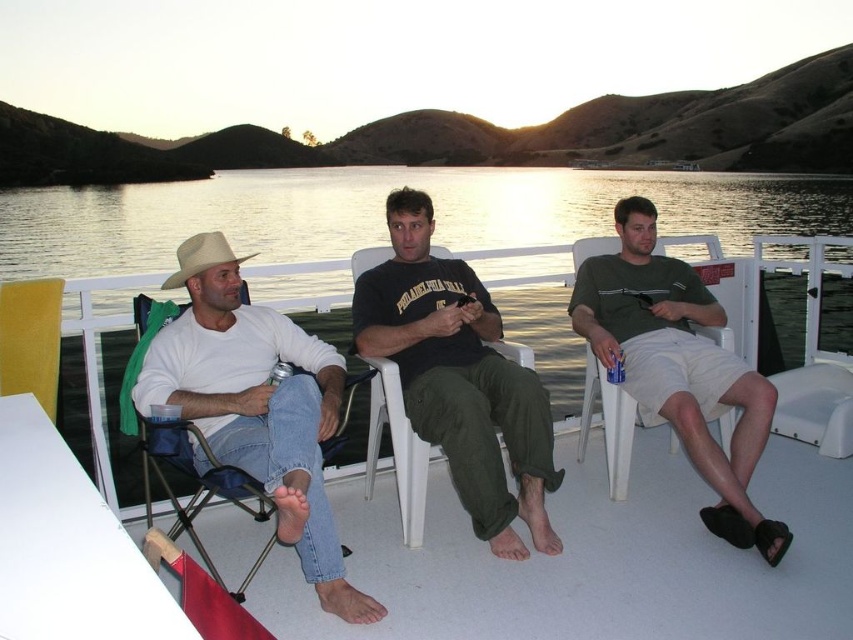
You are on a boat with two people. You see a white matte shirt at left and a yellow fabric chair at left. Which one is positioned more to the right?

The white matte shirt at left is to the right of the yellow fabric chair at left.